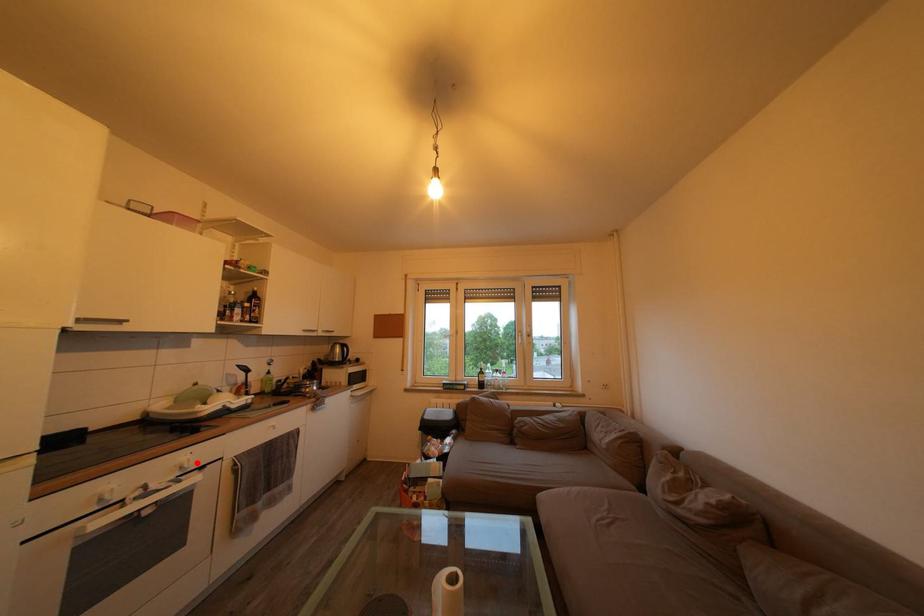
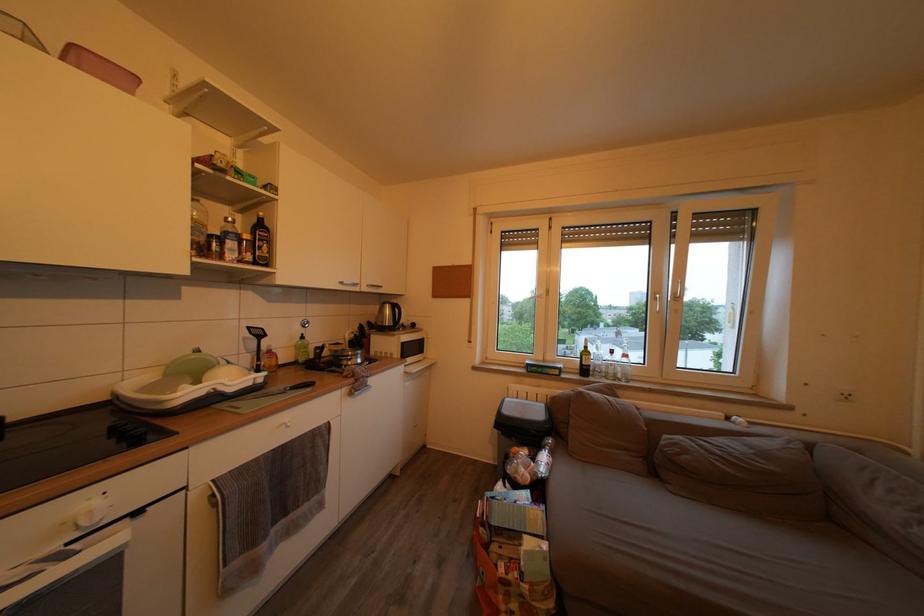
The point at the highlighted location is marked in the first image. Where is the corresponding point in the second image?

(103, 508)